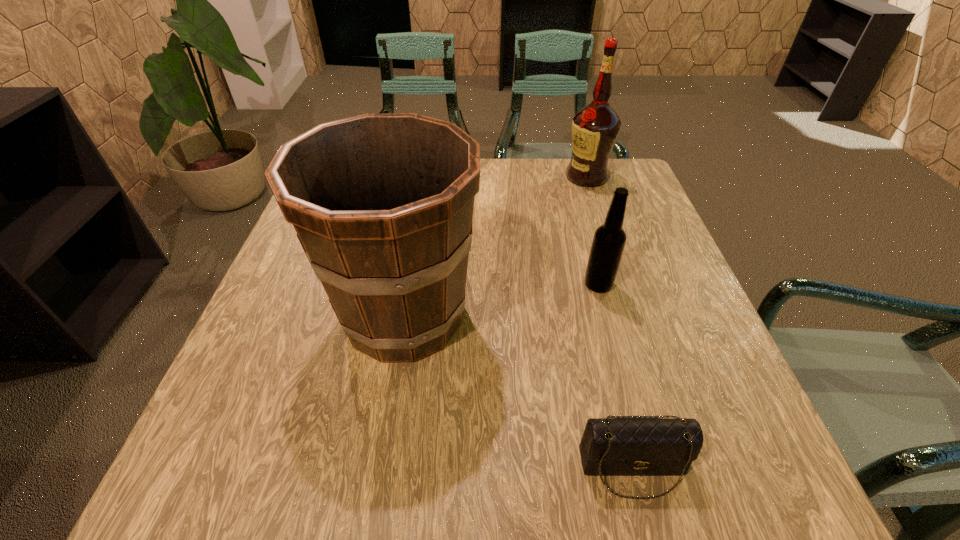
This screenshot has height=540, width=960. I want to click on alcohol, so (x=595, y=128).

Image resolution: width=960 pixels, height=540 pixels. I want to click on the leftmost object, so click(382, 203).

This screenshot has width=960, height=540. In order to click on the second shortest object in this screenshot , I will do `click(609, 240)`.

Where is `clutch bag`? This screenshot has height=540, width=960. clutch bag is located at coordinates [x=616, y=445].

Locate an element on the screen. The height and width of the screenshot is (540, 960). the shortest object is located at coordinates (616, 445).

Where is `vacant area situated on the label of the alcohol`? vacant area situated on the label of the alcohol is located at coordinates (467, 177).

The height and width of the screenshot is (540, 960). Find the location of `free space located on the label of the alcohol`. free space located on the label of the alcohol is located at coordinates (505, 177).

The width and height of the screenshot is (960, 540). I want to click on blank area located 0.140m on the label of the alcohol, so click(x=516, y=177).

The image size is (960, 540). Identify the location of vacant space situated 0.120m on the front of the bucket. (383, 448).

I want to click on free space located 0.200m on the left of the third tallest object, so click(490, 284).